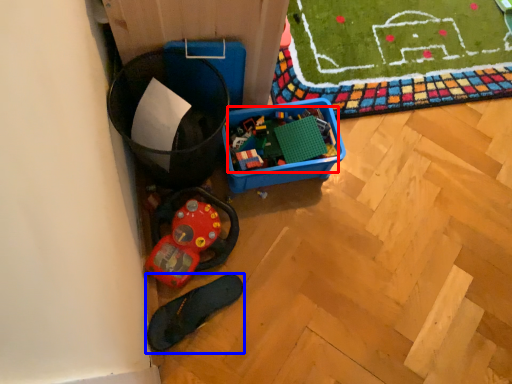
Question: Which point is further to the camera, toy (highlighted by a red box) or footwear (highlighted by a blue box)?

Choices:
 (A) toy
 (B) footwear

Answer: (A)